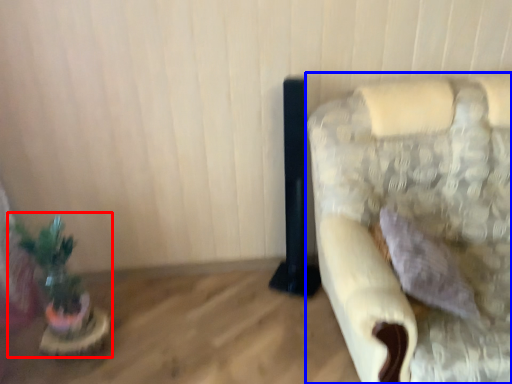
Question: Among these objects, which one is nearest to the camera, houseplant (highlighted by a red box) or furniture (highlighted by a blue box)?

Choices:
 (A) houseplant
 (B) furniture

Answer: (B)